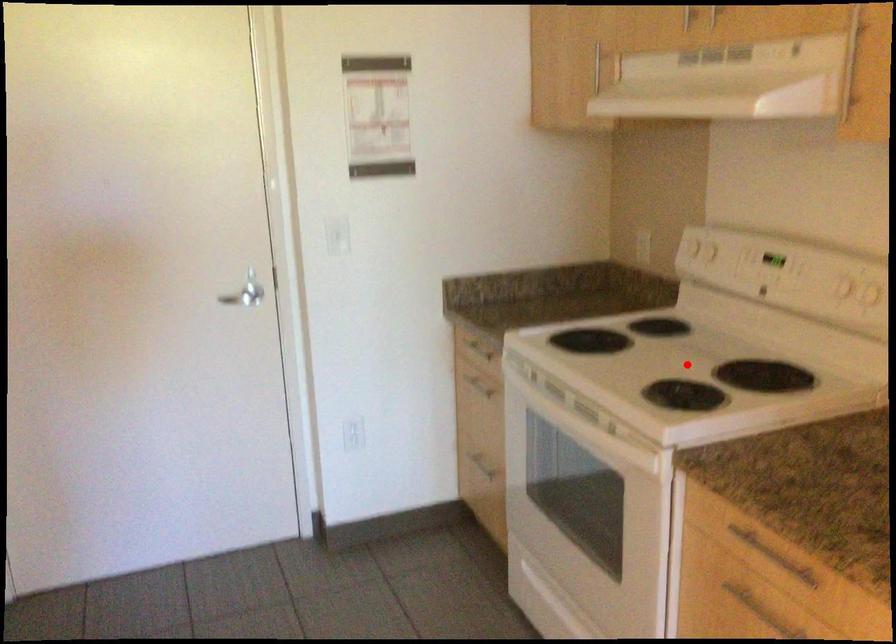
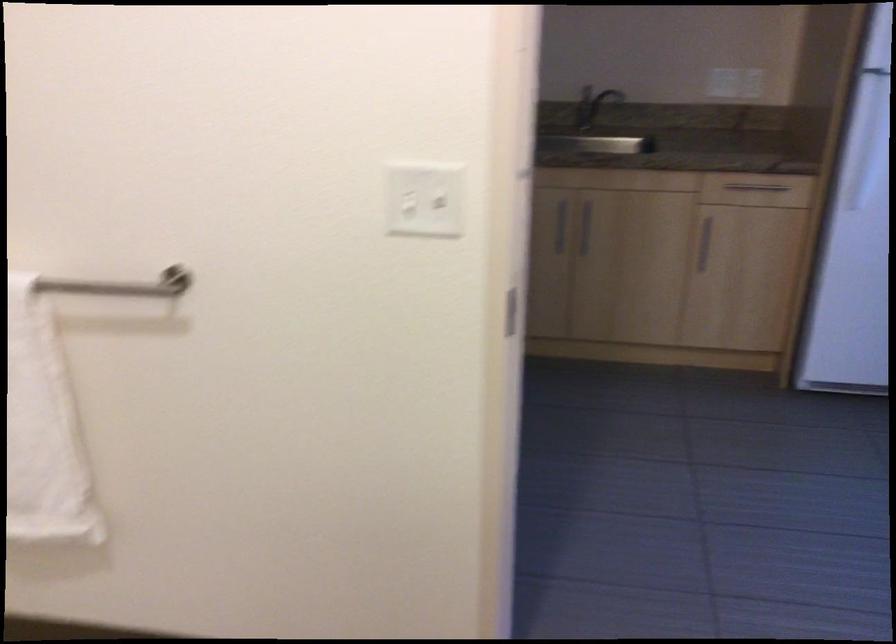
Question: I am providing you with two images of the same scene from different viewpoints. A red point is marked on the first image. At the location where the point appears in image 1, is it still visible in image 2?

Choices:
 (A) Yes
 (B) No

Answer: (B)